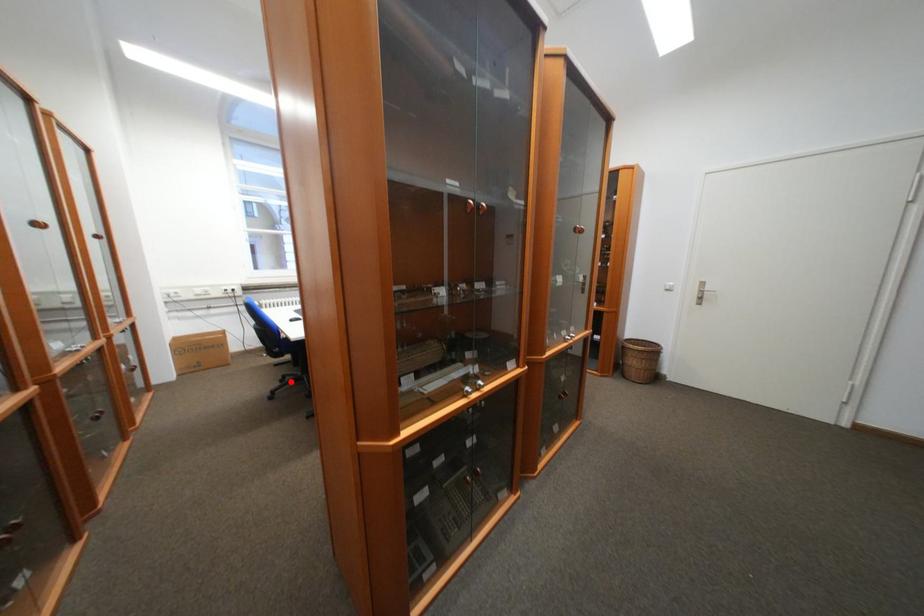
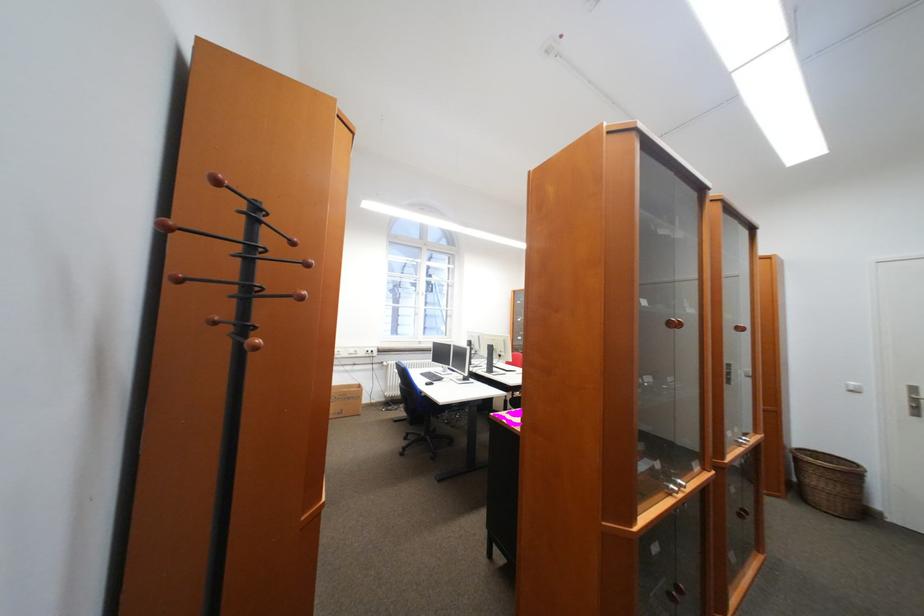
Question: I am providing you with two images of the same scene from different viewpoints. A red point is shown in image1. For the corresponding object point in image2, is it positioned nearer or farther from the camera?

Choices:
 (A) Nearer
 (B) Farther

Answer: (B)